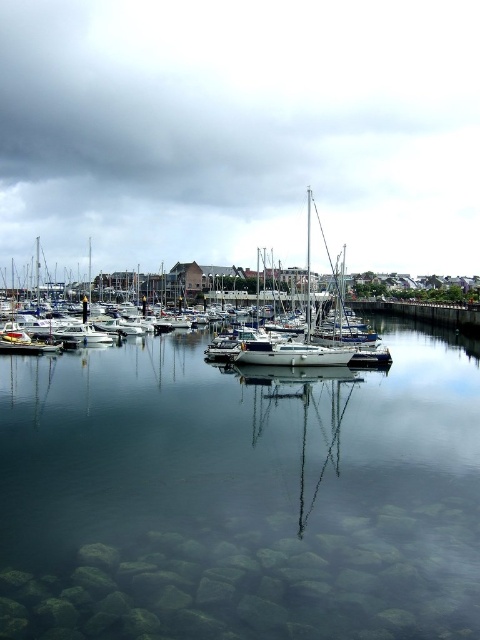
How distant is clear glass water at center from matte white boats at center?

A distance of 363.17 meters exists between clear glass water at center and matte white boats at center.

Is clear glass water at center further to camera compared to matte white boats at center?

No, it is in front of matte white boats at center.

Between point (131, 429) and point (3, 227), which one is positioned in front?

Point (131, 429) is in front.

Locate an element on the screen. The image size is (480, 640). clear glass water at center is located at coordinates (240, 496).

Is point (313, 381) less distant than point (236, 353)?

That is True.

Between clear glass water at center and white glossy sailboat at center, which one appears on the right side from the viewer's perspective?

white glossy sailboat at center is more to the right.

The image size is (480, 640). What do you see at coordinates (240, 496) in the screenshot?
I see `clear glass water at center` at bounding box center [240, 496].

At what (x,y) coordinates should I click in order to perform the action: click on clear glass water at center. Please return your answer as a coordinate pair (x, y). Looking at the image, I should click on (240, 496).

Consider the image. Who is lower down, matte white boats at center or white glossy sailboat at center?

white glossy sailboat at center is lower down.

Is matte white boats at center bigger than white glossy sailboat at center?

Yes.

Find the location of a particular element. This screenshot has width=480, height=640. matte white boats at center is located at coordinates (240, 129).

Find the location of a particular element. The width and height of the screenshot is (480, 640). matte white boats at center is located at coordinates (240, 129).